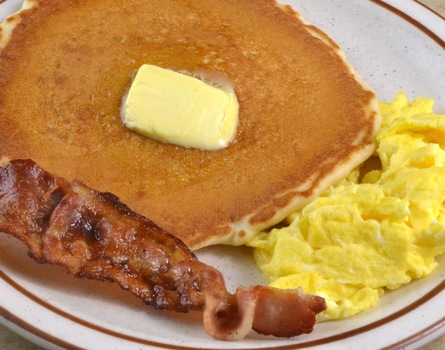
The width and height of the screenshot is (445, 350). What are the coordinates of `plate` in the screenshot? It's located at (381, 49).